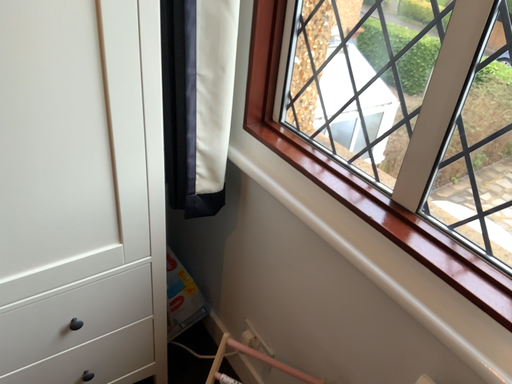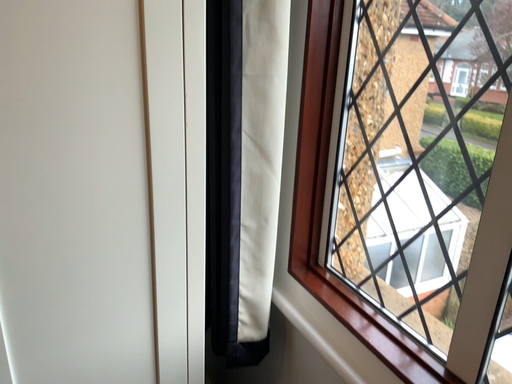
Question: Which way did the camera rotate in the video?

Choices:
 (A) rotated downward
 (B) rotated upward

Answer: (B)